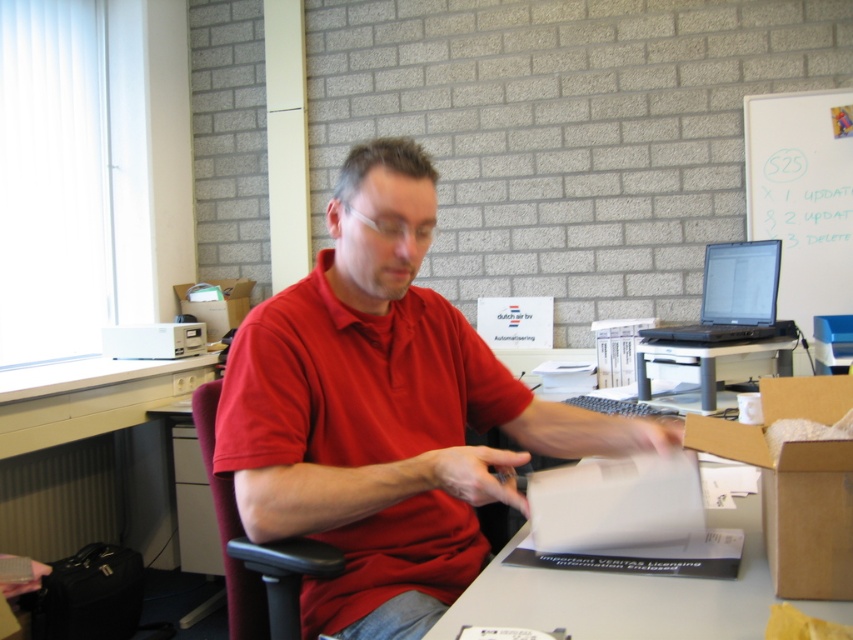
Is white paper at center thinner than brown cardboard box at lower right?

Incorrect, white paper at center's width is not less than brown cardboard box at lower right's.

Is white paper at center to the right of brown cardboard box at lower right from the viewer's perspective?

Incorrect, white paper at center is not on the right side of brown cardboard box at lower right.

Between point (773, 554) and point (840, 529), which one is positioned in front?

Positioned in front is point (840, 529).

Find the location of a particular element. The height and width of the screenshot is (640, 853). white paper at center is located at coordinates (697, 579).

Between point (753, 426) and point (311, 548), which one is positioned in front?

Point (311, 548)

Who is higher up, brown cardboard box at lower right or black plastic chair at center?

brown cardboard box at lower right

Image resolution: width=853 pixels, height=640 pixels. I want to click on brown cardboard box at lower right, so click(x=796, y=483).

Can you confirm if white paper at center is shorter than black matte laptop at upper right?

Yes, white paper at center is shorter than black matte laptop at upper right.

Who is positioned more to the right, white paper at center or black matte laptop at upper right?

black matte laptop at upper right

Does point (804, 472) come closer to viewer compared to point (727, 323)?

Yes, it is in front of point (727, 323).

The width and height of the screenshot is (853, 640). I want to click on white paper at center, so click(x=697, y=579).